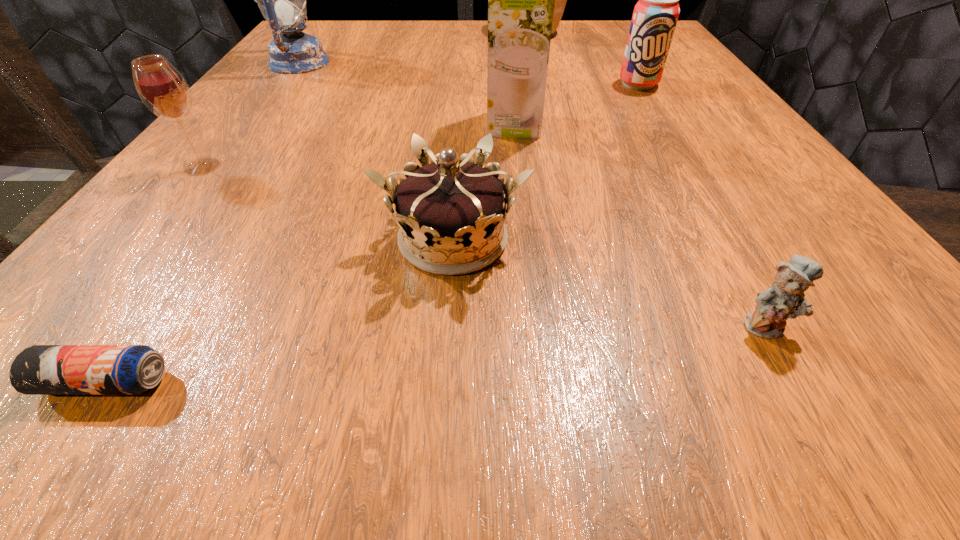
Locate an element on the screen. This screenshot has width=960, height=540. pitcher positioned at the far edge is located at coordinates (560, 0).

The height and width of the screenshot is (540, 960). What are the coordinates of `lantern situated at the far edge` in the screenshot? It's located at (282, 0).

You are a GUI agent. You are given a task and a screenshot of the screen. Output one action in this format:
    pyautogui.click(x=<x>, y=<y>)
    Task: Click on the teddy bear that is at the near edge
    
    Given the screenshot: What is the action you would take?
    pyautogui.click(x=784, y=299)

Image resolution: width=960 pixels, height=540 pixels. I want to click on beer can at the near edge, so click(x=40, y=369).

Identify the location of lantern situated at the left edge. (282, 0).

Identify the location of wineglass located at the left edge. (163, 90).

Where is `beer can located in the left edge section of the desktop`? beer can located in the left edge section of the desktop is located at coordinates (40, 369).

The image size is (960, 540). Identify the location of soda can located in the right edge section of the desktop. (655, 15).

You are a GUI agent. You are given a task and a screenshot of the screen. Output one action in this format:
    pyautogui.click(x=<x>, y=<y>)
    Task: Click on the teddy bear that is at the right edge
    This screenshot has width=960, height=540.
    Given the screenshot: What is the action you would take?
    pyautogui.click(x=784, y=299)

Locate an element on the screen. object located in the far left corner section of the desktop is located at coordinates (282, 0).